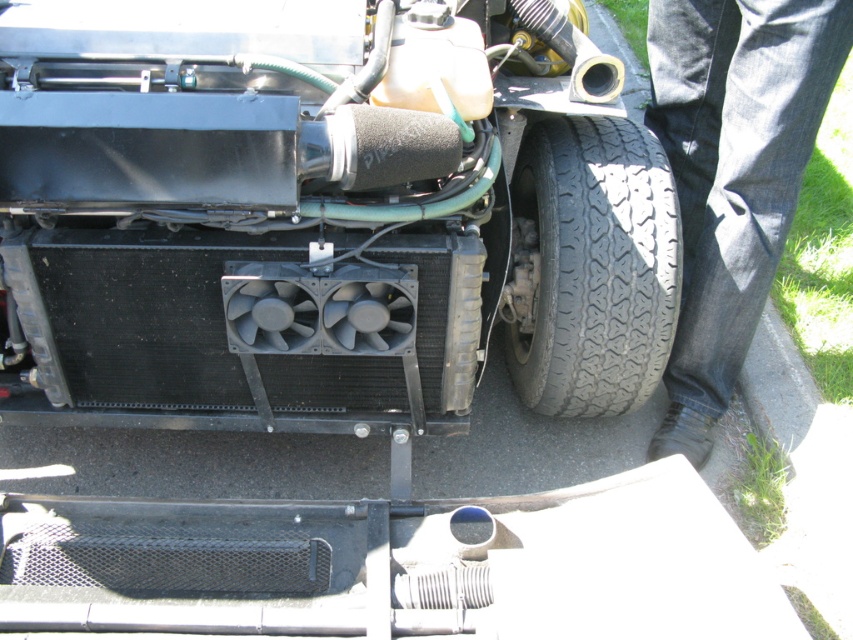
Between dark blue jeans at lower right and black rubber tire at lower right, which one appears on the left side from the viewer's perspective?

black rubber tire at lower right is more to the left.

Image resolution: width=853 pixels, height=640 pixels. Find the location of `dark blue jeans at lower right`. dark blue jeans at lower right is located at coordinates (732, 173).